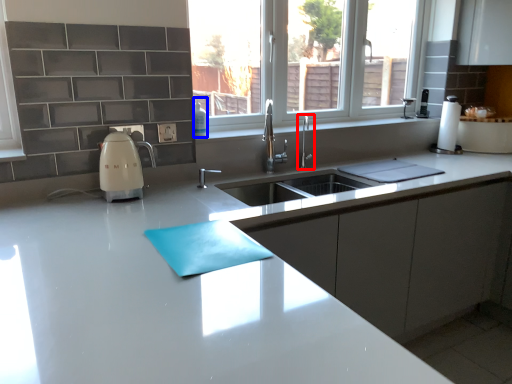
Question: Which of the following is the farthest to the observer, tap (highlighted by a red box) or soap dispenser (highlighted by a blue box)?

Choices:
 (A) tap
 (B) soap dispenser

Answer: (A)